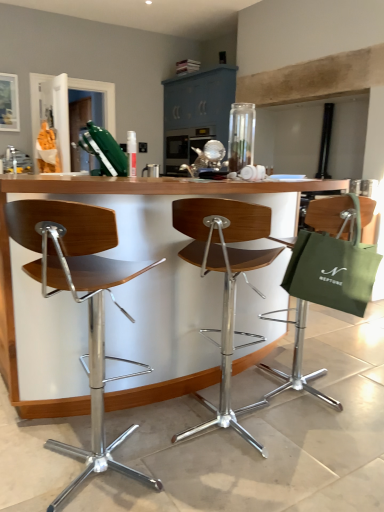
What do you see at coordinates (333, 268) in the screenshot? This screenshot has width=384, height=512. I see `green canvas tote at right` at bounding box center [333, 268].

Image resolution: width=384 pixels, height=512 pixels. What do you see at coordinates (326, 287) in the screenshot?
I see `green fabric bag at right, which appears as the first chair when viewed from the right` at bounding box center [326, 287].

What are the coordinates of `wooden seat at center, which is counted as the second chair, starting from the left` in the screenshot? It's located at (224, 281).

Locate an element on the screen. Image resolution: width=384 pixels, height=512 pixels. wooden seat at center, acting as the third chair starting from the right is located at coordinates (80, 301).

The image size is (384, 512). Find the location of `woodenmaterial/texturetable at center`. woodenmaterial/texturetable at center is located at coordinates (98, 197).

This screenshot has width=384, height=512. In order to click on green canvas tote at right in this screenshot , I will do `click(333, 268)`.

How much distance is there between woodenmaterial/texturetable at center and wooden seat at center, which is counted as the 2th chair, starting from the right?

They are 28.97 centimeters apart.

Can you confirm if woodenmaterial/texturetable at center is taller than wooden seat at center, which is counted as the second chair, starting from the left?

Yes.

Is point (127, 393) farther from viewer compared to point (202, 259)?

Yes, it is behind point (202, 259).

From the image's perspective, would you say woodenmaterial/texturetable at center is positioned over wooden seat at center, which is counted as the second chair, starting from the left?

Indeed, from the image's perspective, woodenmaterial/texturetable at center is shown above wooden seat at center, which is counted as the second chair, starting from the left.

Consider the image. Which of these two, green canvas tote at right or wooden seat at center, acting as the third chair starting from the right, stands taller?

Standing taller between the two is wooden seat at center, acting as the third chair starting from the right.

The width and height of the screenshot is (384, 512). What are the coordinates of `the 3rd chair positioned below the green canvas tote at right (from a real-world perspective)` in the screenshot? It's located at tap(80, 301).

What's the angular difference between green canvas tote at right and wooden seat at center, positioned as the first chair in left-to-right order,'s facing directions?

green canvas tote at right and wooden seat at center, positioned as the first chair in left-to-right order, are facing 161 degrees away from each other.

From a real-world perspective, which is physically below, green canvas tote at right or wooden seat at center, positioned as the first chair in left-to-right order?

wooden seat at center, positioned as the first chair in left-to-right order.

Which point is more distant from viewer, (128, 435) or (296, 287)?

The point (296, 287) is farther.

Is green canvas tote at right at the back of wooden seat at center, acting as the third chair starting from the right?

wooden seat at center, acting as the third chair starting from the right, is not turned away from green canvas tote at right.

Considering the sizes of objects wooden seat at center, positioned as the first chair in left-to-right order, and green canvas tote at right in the image provided, who is shorter, wooden seat at center, positioned as the first chair in left-to-right order, or green canvas tote at right?

With less height is green canvas tote at right.

Can you confirm if wooden seat at center, acting as the third chair starting from the right, is wider than green canvas tote at right?

Yes.

From the picture: Is wooden seat at center, which is counted as the second chair, starting from the left, positioned before green fabric bag at right, the 3th chair positioned from the left?

That is True.

From a real-world perspective, does wooden seat at center, which is counted as the second chair, starting from the left, stand above green fabric bag at right, the 3th chair positioned from the left?

No, from a real-world perspective, wooden seat at center, which is counted as the second chair, starting from the left, is not over green fabric bag at right, the 3th chair positioned from the left

Do you think wooden seat at center, which is counted as the second chair, starting from the left, is within green fabric bag at right, which appears as the first chair when viewed from the right, or outside of it?

wooden seat at center, which is counted as the second chair, starting from the left, is not inside green fabric bag at right, which appears as the first chair when viewed from the right, it's outside.

Considering the relative sizes of wooden seat at center, which is counted as the second chair, starting from the left, and green fabric bag at right, which appears as the first chair when viewed from the right, in the image provided, is wooden seat at center, which is counted as the second chair, starting from the left, smaller than green fabric bag at right, which appears as the first chair when viewed from the right,?

No.

What's the angular difference between woodenmaterial/texturetable at center and green fabric bag at right, which appears as the first chair when viewed from the right,'s facing directions?

woodenmaterial/texturetable at center and green fabric bag at right, which appears as the first chair when viewed from the right, are facing 9.81 degrees away from each other.

In the scene shown: Who is smaller, woodenmaterial/texturetable at center or green fabric bag at right, the 3th chair positioned from the left?

green fabric bag at right, the 3th chair positioned from the left.

Does woodenmaterial/texturetable at center have a lesser width compared to green fabric bag at right, which appears as the first chair when viewed from the right?

No.

Would you say woodenmaterial/texturetable at center is outside wooden seat at center, acting as the third chair starting from the right?

Yes, woodenmaterial/texturetable at center is not within wooden seat at center, acting as the third chair starting from the right.

Is woodenmaterial/texturetable at center behind wooden seat at center, positioned as the first chair in left-to-right order?

Yes, woodenmaterial/texturetable at center is further from the camera.

From the image's perspective, between woodenmaterial/texturetable at center and wooden seat at center, acting as the third chair starting from the right, who is located below?

wooden seat at center, acting as the third chair starting from the right, is shown below in the image.

This screenshot has height=512, width=384. I want to click on the 3rd chair below the woodenmaterial/texturetable at center (from the image's perspective), so click(x=80, y=301).

Considering the relative positions of wooden seat at center, which is counted as the 2th chair, starting from the right, and woodenmaterial/texturetable at center in the image provided, is wooden seat at center, which is counted as the 2th chair, starting from the right, to the left of woodenmaterial/texturetable at center from the viewer's perspective?

No, wooden seat at center, which is counted as the 2th chair, starting from the right, is not to the left of woodenmaterial/texturetable at center.

Can you confirm if wooden seat at center, which is counted as the second chair, starting from the left, is wider than woodenmaterial/texturetable at center?

In fact, wooden seat at center, which is counted as the second chair, starting from the left, might be narrower than woodenmaterial/texturetable at center.

Is point (176, 227) closer or farther from the camera than point (208, 184)?

Clearly, point (176, 227) is more distant from the camera than point (208, 184).

Where is `table that appears on the left of wooden seat at center, which is counted as the second chair, starting from the left`? table that appears on the left of wooden seat at center, which is counted as the second chair, starting from the left is located at coordinates (98, 197).

The image size is (384, 512). In order to click on shopping bag above the wooden seat at center, acting as the third chair starting from the right (from a real-world perspective) in this screenshot , I will do `click(333, 268)`.

From the image, which object appears to be farther from woodenmaterial/texturetable at center, wooden seat at center, which is counted as the 2th chair, starting from the right, or wooden seat at center, positioned as the first chair in left-to-right order?

Among the two, wooden seat at center, which is counted as the 2th chair, starting from the right, is located further to woodenmaterial/texturetable at center.

Which object lies nearer to the anchor point wooden seat at center, positioned as the first chair in left-to-right order, woodenmaterial/texturetable at center or green canvas tote at right?

woodenmaterial/texturetable at center is positioned closer to the anchor wooden seat at center, positioned as the first chair in left-to-right order.

When comparing their distances from green canvas tote at right, does green fabric bag at right, the 3th chair positioned from the left, or woodenmaterial/texturetable at center seem closer?

green fabric bag at right, the 3th chair positioned from the left.

Which object lies nearer to the anchor point green canvas tote at right, wooden seat at center, which is counted as the 2th chair, starting from the right, or green fabric bag at right, the 3th chair positioned from the left?

green fabric bag at right, the 3th chair positioned from the left.

From the image, which object appears to be farther from green canvas tote at right, woodenmaterial/texturetable at center or wooden seat at center, which is counted as the 2th chair, starting from the right?

Among the two, woodenmaterial/texturetable at center is located further to green canvas tote at right.

Based on their spatial positions, is wooden seat at center, positioned as the first chair in left-to-right order, or woodenmaterial/texturetable at center closer to green fabric bag at right, which appears as the first chair when viewed from the right?

The object closer to green fabric bag at right, which appears as the first chair when viewed from the right, is woodenmaterial/texturetable at center.

Based on their spatial positions, is green fabric bag at right, which appears as the first chair when viewed from the right, or green canvas tote at right closer to wooden seat at center, acting as the third chair starting from the right?

Based on the image, green canvas tote at right appears to be nearer to wooden seat at center, acting as the third chair starting from the right.

Looking at the image, which one is located further to woodenmaterial/texturetable at center, green fabric bag at right, which appears as the first chair when viewed from the right, or green canvas tote at right?

green fabric bag at right, which appears as the first chair when viewed from the right, is further to woodenmaterial/texturetable at center.

Locate an element on the screen. The image size is (384, 512). chair between woodenmaterial/texturetable at center and wooden seat at center, which is counted as the second chair, starting from the left, from left to right is located at coordinates (80, 301).

Identify the location of chair situated between wooden seat at center, which is counted as the 2th chair, starting from the right, and green canvas tote at right from left to right. This screenshot has height=512, width=384. (326, 287).

The width and height of the screenshot is (384, 512). Identify the location of chair located between wooden seat at center, acting as the third chair starting from the right, and green fabric bag at right, which appears as the first chair when viewed from the right, in the left-right direction. (224, 281).